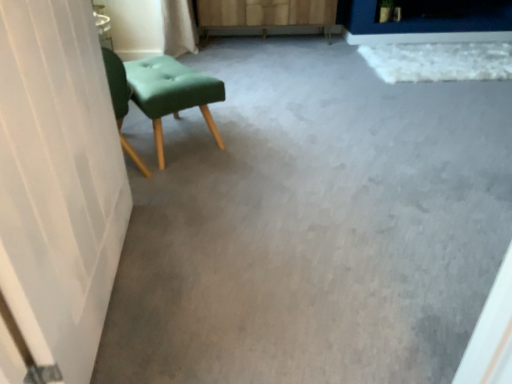
Question: Is matte green fabric stool at left closer to the viewer compared to wooden dresser at center?

Choices:
 (A) yes
 (B) no

Answer: (A)

Question: Does matte green fabric stool at left have a lesser width compared to wooden dresser at center?

Choices:
 (A) yes
 (B) no

Answer: (A)

Question: Are matte green fabric stool at left and wooden dresser at center beside each other?

Choices:
 (A) no
 (B) yes

Answer: (A)

Question: Can you confirm if matte green fabric stool at left is positioned to the left of wooden dresser at center?

Choices:
 (A) no
 (B) yes

Answer: (B)

Question: From a real-world perspective, is matte green fabric stool at left physically below wooden dresser at center?

Choices:
 (A) no
 (B) yes

Answer: (B)

Question: Considering the relative sizes of matte green fabric stool at left and wooden dresser at center in the image provided, is matte green fabric stool at left taller than wooden dresser at center?

Choices:
 (A) no
 (B) yes

Answer: (A)

Question: Does matte gray carpet at center have a greater width compared to matte green fabric stool at left?

Choices:
 (A) yes
 (B) no

Answer: (A)

Question: Are matte gray carpet at center and matte green fabric stool at left making contact?

Choices:
 (A) no
 (B) yes

Answer: (A)

Question: Can you confirm if matte gray carpet at center is smaller than matte green fabric stool at left?

Choices:
 (A) yes
 (B) no

Answer: (B)

Question: Is matte gray carpet at center far away from matte green fabric stool at left?

Choices:
 (A) no
 (B) yes

Answer: (A)

Question: Is matte gray carpet at center at the left side of matte green fabric stool at left?

Choices:
 (A) no
 (B) yes

Answer: (A)

Question: Can you confirm if matte gray carpet at center is positioned to the right of matte green fabric stool at left?

Choices:
 (A) yes
 (B) no

Answer: (A)

Question: From the image's perspective, is matte green fabric stool at left on matte gray carpet at center?

Choices:
 (A) no
 (B) yes

Answer: (A)